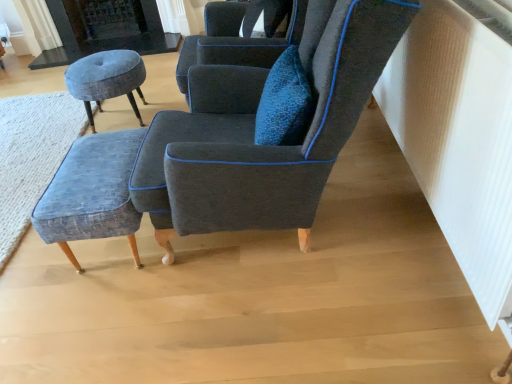
Question: From a real-world perspective, is velvet dark blue armchair at center, placed as the 2th chair when sorted from front to back, positioned above or below velvet blue armchair at center, placed as the second chair when sorted from back to front?

Choices:
 (A) below
 (B) above

Answer: (A)

Question: Is point (212, 29) positioned closer to the camera than point (283, 208)?

Choices:
 (A) closer
 (B) farther

Answer: (B)

Question: Which is farther from the velvet blue armchair at center, placed as the second chair when sorted from back to front?

Choices:
 (A) velvet blue stool at left, the second stool viewed from the front
 (B) velvet dark blue armchair at center, placed as the 2th chair when sorted from front to back
 (C) velvet blue ottoman at lower left
 (D) black stone fireplace at upper left
 (E) textured blue fabric stool at lower left, acting as the 2th stool starting from the back

Answer: (D)

Question: Estimate the real-world distances between objects in this image. Which object is closer to the velvet blue armchair at center, placed as the second chair when sorted from back to front?

Choices:
 (A) textured blue fabric stool at lower left, which ranks as the second stool in top-to-bottom order
 (B) black stone fireplace at upper left
 (C) velvet blue ottoman at lower left
 (D) velvet dark blue armchair at center, which is counted as the first chair, starting from the back
 (E) velvet blue stool at left, placed as the first stool when sorted from top to bottom

Answer: (A)